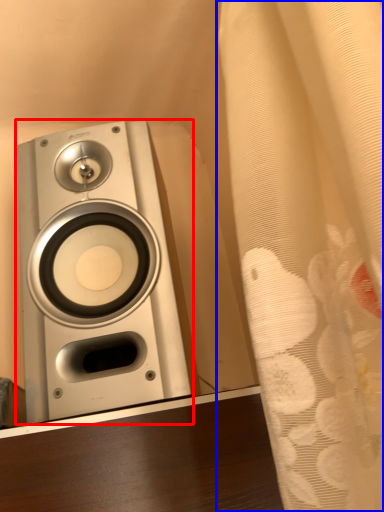
Question: Which object is further to the camera taking this photo, home appliance (highlighted by a red box) or curtain (highlighted by a blue box)?

Choices:
 (A) home appliance
 (B) curtain

Answer: (A)